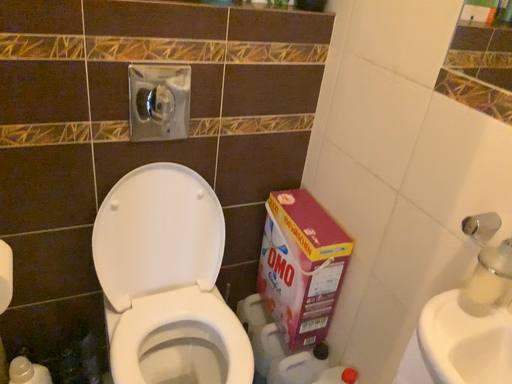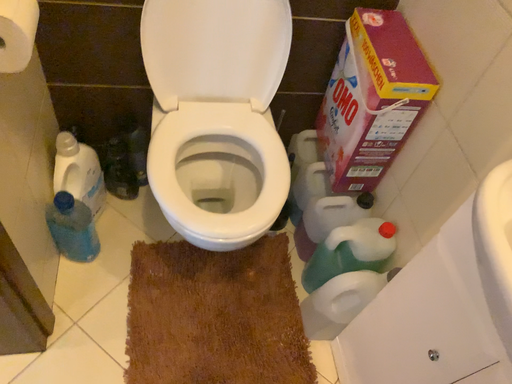
Question: How did the camera likely rotate when shooting the video?

Choices:
 (A) rotated upward
 (B) rotated downward

Answer: (B)